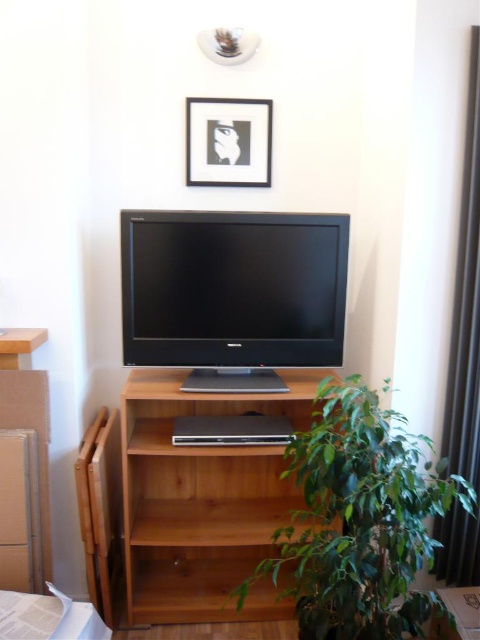
In the scene shown: You are positioning a new picture frame on the wall and need to know the exact coordinates to place it so it aligns with the light brown wood shelf at center. What are the coordinates for the shelf?

The light brown wood shelf at center is located at point [204,500].

You are organizing the living room and notice the white matte picture frame at upper center and the white paper at lower left. Which object is larger in size?

The white paper at lower left is larger in size than the white matte picture frame at upper center.

You are an interior designer assessing the layout of the living room. You need to determine if the white paper at lower left can fit into a space reserved for an object of the same width as the white matte picture frame at upper center. Based on the scene, what is your recommendation?

The white matte picture frame at upper center is wider than the white paper at lower left, so the white paper at lower left would fit into the space reserved for the white matte picture frame at upper center since it is narrower.